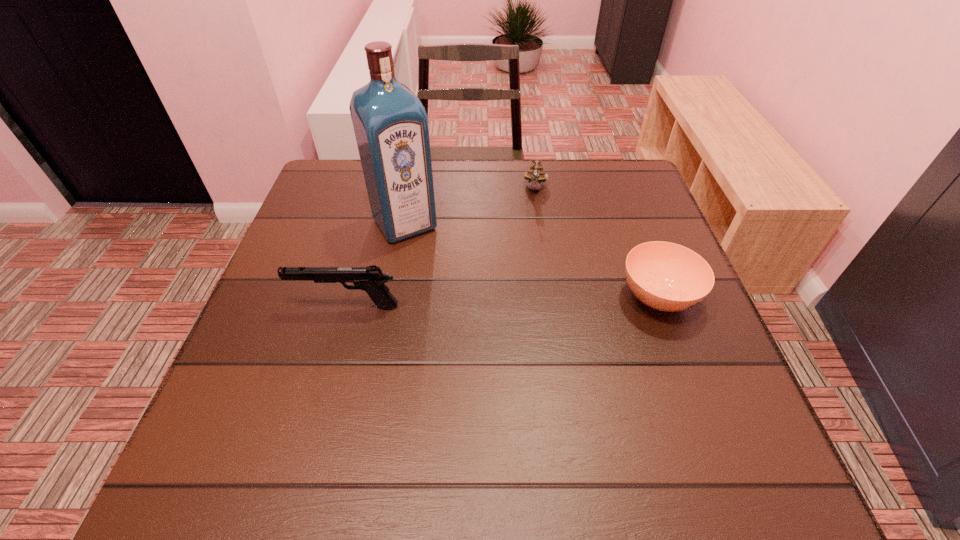
Image resolution: width=960 pixels, height=540 pixels. Find the location of `gun`. gun is located at coordinates (371, 279).

Locate an element on the screen. the rightmost object is located at coordinates (665, 276).

Locate an element on the screen. This screenshot has width=960, height=540. soup bowl is located at coordinates (665, 276).

The image size is (960, 540). What are the coordinates of `the farthest object` in the screenshot? It's located at click(x=535, y=175).

The image size is (960, 540). I want to click on snail, so click(x=535, y=175).

The width and height of the screenshot is (960, 540). In order to click on liquor in this screenshot , I will do `click(390, 123)`.

Locate an element on the screen. This screenshot has width=960, height=540. the tallest object is located at coordinates (390, 123).

Where is `vacant area situated at the aiming end of the gun`? The height and width of the screenshot is (540, 960). vacant area situated at the aiming end of the gun is located at coordinates (266, 306).

At what (x,y) coordinates should I click in order to perform the action: click on free location located on the left of the rightmost object. Please return your answer as a coordinate pair (x, y). The image size is (960, 540). Looking at the image, I should click on (586, 296).

The width and height of the screenshot is (960, 540). I want to click on vacant area located 0.390m on the face of the snail, so click(x=519, y=315).